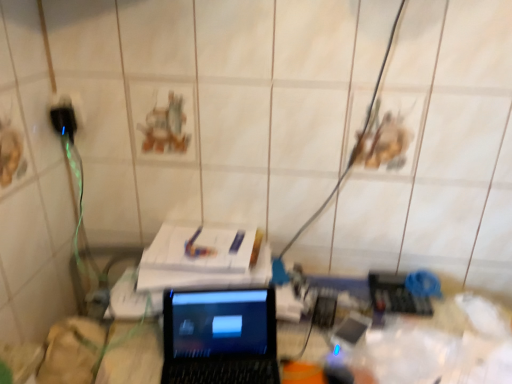
Locate an element on the screen. The image size is (512, 384). black glossy laptop at center is located at coordinates (220, 337).

Describe the element at coordinates (220, 337) in the screenshot. This screenshot has height=384, width=512. I see `black glossy laptop at center` at that location.

I want to click on black plastic plug at left, so click(64, 120).

What do you see at coordinates (64, 120) in the screenshot?
I see `black plastic plug at left` at bounding box center [64, 120].

Where is `black glossy laptop at center`? black glossy laptop at center is located at coordinates point(220,337).

Between black glossy laptop at center and black plastic plug at left, which one appears on the left side from the viewer's perspective?

Positioned to the left is black plastic plug at left.

Which is in front, black glossy laptop at center or black plastic plug at left?

black glossy laptop at center.

Which is nearer, (244,381) or (70,125)?

Point (244,381) appears to be closer to the viewer than point (70,125).

From the image's perspective, is black glossy laptop at center beneath black plastic plug at left?

Yes, from the image's perspective, black glossy laptop at center is below black plastic plug at left.

In the scene shown: From a real-world perspective, does black glossy laptop at center sit lower than black plastic plug at left?

Yes.

Based on the photo, between black glossy laptop at center and black plastic plug at left, which one has smaller width?

With smaller width is black plastic plug at left.

In terms of height, does black glossy laptop at center look taller or shorter compared to black plastic plug at left?

Clearly, black glossy laptop at center is taller compared to black plastic plug at left.

Can you confirm if black glossy laptop at center is smaller than black plastic plug at left?

Actually, black glossy laptop at center might be larger than black plastic plug at left.

Is black glossy laptop at center inside or outside of black plastic plug at left?

black glossy laptop at center is spatially situated outside black plastic plug at left.

Can you see black glossy laptop at center touching black plastic plug at left?

No, black glossy laptop at center is not in contact with black plastic plug at left.

Does black glossy laptop at center turn towards black plastic plug at left?

No.

Can you tell me how much black glossy laptop at center and black plastic plug at left differ in facing direction?

The facing directions of black glossy laptop at center and black plastic plug at left are 9.66 degrees apart.

Image resolution: width=512 pixels, height=384 pixels. I want to click on laptop in front of the black plastic plug at left, so click(220, 337).

Considering the positions of objects black plastic plug at left and black glossy laptop at center in the image provided, who is more to the right, black plastic plug at left or black glossy laptop at center?

Positioned to the right is black glossy laptop at center.

Which is in front, black plastic plug at left or black glossy laptop at center?

black glossy laptop at center is closer to the camera.

Is point (68, 107) behind point (248, 336)?

Yes, it is behind point (248, 336).

From the image's perspective, which is below, black plastic plug at left or black glossy laptop at center?

black glossy laptop at center.

From a real-world perspective, is black plastic plug at left below black glossy laptop at center?

No, from a real-world perspective, black plastic plug at left is not beneath black glossy laptop at center.

Between black plastic plug at left and black glossy laptop at center, which one has larger width?

black glossy laptop at center is wider.

Between black plastic plug at left and black glossy laptop at center, which one has less height?

With less height is black plastic plug at left.

Looking at the image, does black plastic plug at left seem bigger or smaller compared to black glossy laptop at center?

Considering their sizes, black plastic plug at left takes up less space than black glossy laptop at center.

Would you say black plastic plug at left is inside or outside black glossy laptop at center?

black plastic plug at left is not inside black glossy laptop at center, it's outside.

Is black plastic plug at left next to black glossy laptop at center and touching it?

No, black plastic plug at left is not beside black glossy laptop at center.

Is black plastic plug at left aimed at black glossy laptop at center?

No, black plastic plug at left is not turned towards black glossy laptop at center.

Can you tell me how much black plastic plug at left and black glossy laptop at center differ in facing direction?

The angular difference between black plastic plug at left and black glossy laptop at center is 9.66 degrees.

How distant is black plastic plug at left from black glossy laptop at center?

black plastic plug at left is 71.90 centimeters from black glossy laptop at center.

Locate an element on the screen. This screenshot has height=384, width=512. plug located above the black glossy laptop at center (from a real-world perspective) is located at coordinates (64, 120).

The height and width of the screenshot is (384, 512). I want to click on laptop that is in front of the black plastic plug at left, so click(220, 337).

What are the coordinates of `laptop on the right of black plastic plug at left` in the screenshot? It's located at (220, 337).